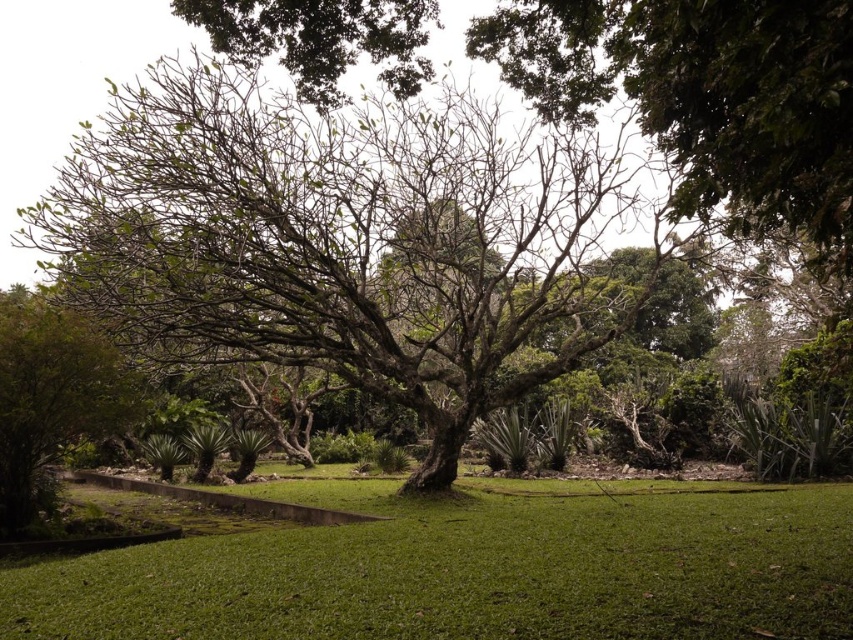
Question: Where is green leafy tree at center located in relation to green grass at center in the image?

Choices:
 (A) below
 (B) above

Answer: (B)

Question: Which object is farther from the camera taking this photo?

Choices:
 (A) green leafy tree at center
 (B) green grass at center

Answer: (A)

Question: Does green leafy tree at center appear under green grass at center?

Choices:
 (A) no
 (B) yes

Answer: (A)

Question: Which of the following is the closest to the observer?

Choices:
 (A) (418, 145)
 (B) (809, 500)

Answer: (B)

Question: Is green leafy tree at center positioned in front of green grass at center?

Choices:
 (A) no
 (B) yes

Answer: (A)

Question: Which of the following is the farthest from the observer?

Choices:
 (A) green leafy tree at center
 (B) green grass at center

Answer: (A)